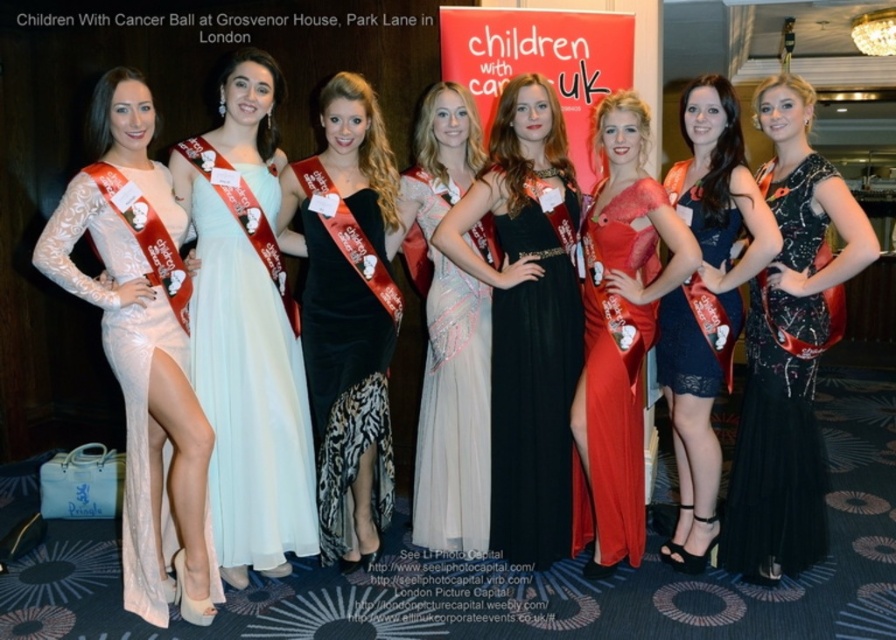
Question: Is shiny satin dress at center to the left of lace dress at center from the viewer's perspective?

Choices:
 (A) yes
 (B) no

Answer: (A)

Question: Which point is farther from the camera taking this photo?

Choices:
 (A) (629, 93)
 (B) (707, 506)
 (C) (204, 241)
 (D) (82, 230)

Answer: (B)

Question: Does light blue satin dress at left have a lesser width compared to pearl lace dress at center?

Choices:
 (A) no
 (B) yes

Answer: (A)

Question: Which point is closer to the camera taking this photo?

Choices:
 (A) (584, 492)
 (B) (194, 260)

Answer: (B)

Question: Which object is the farthest from the light blue satin dress at left?

Choices:
 (A) black satin dress at center
 (B) sequined black dress at center

Answer: (B)

Question: Can you confirm if velvet black dress at center is positioned above shiny satin dress at center?

Choices:
 (A) no
 (B) yes

Answer: (B)